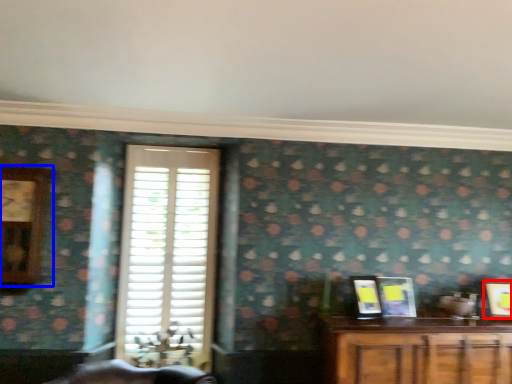
Question: Which object appears closest to the camera in this image, picture frame (highlighted by a red box) or clock (highlighted by a blue box)?

Choices:
 (A) picture frame
 (B) clock

Answer: (B)